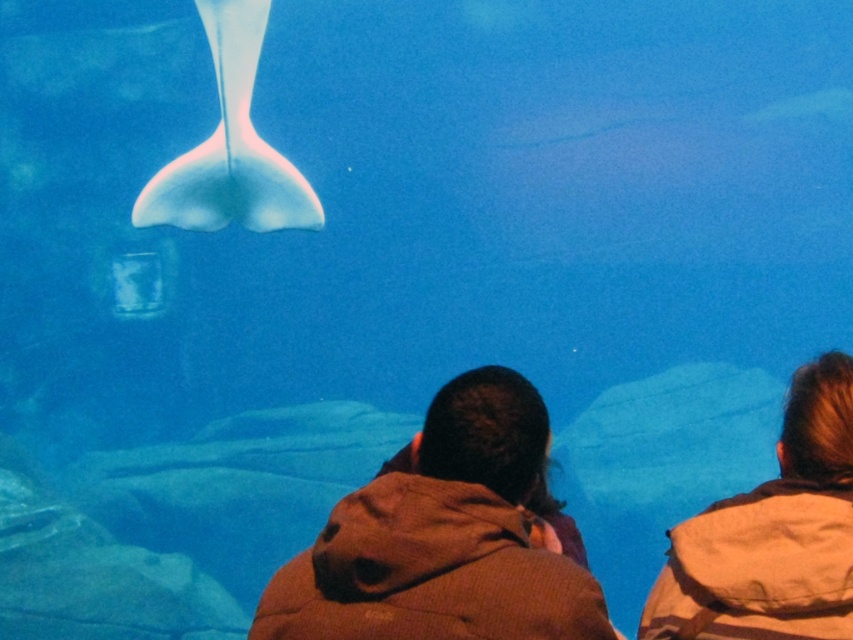
Question: Can you confirm if brown textured jacket at upper right is wider than translucent white stingray at upper center?

Choices:
 (A) no
 (B) yes

Answer: (A)

Question: Is brown textured jacket at upper right to the left of translucent white stingray at upper center from the viewer's perspective?

Choices:
 (A) yes
 (B) no

Answer: (B)

Question: Which object appears farthest from the camera in this image?

Choices:
 (A) translucent white stingray at upper center
 (B) brown textured jacket at upper right

Answer: (A)

Question: Is brown textured jacket at upper right to the right of translucent white stingray at upper center from the viewer's perspective?

Choices:
 (A) no
 (B) yes

Answer: (B)

Question: Which point is closer to the camera taking this photo?

Choices:
 (A) (698, 588)
 (B) (281, 209)

Answer: (A)